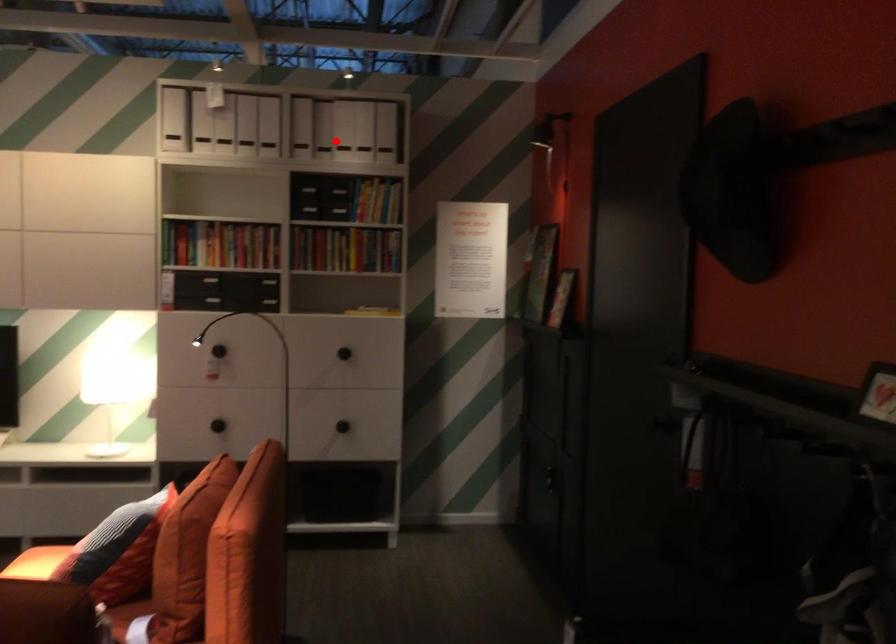
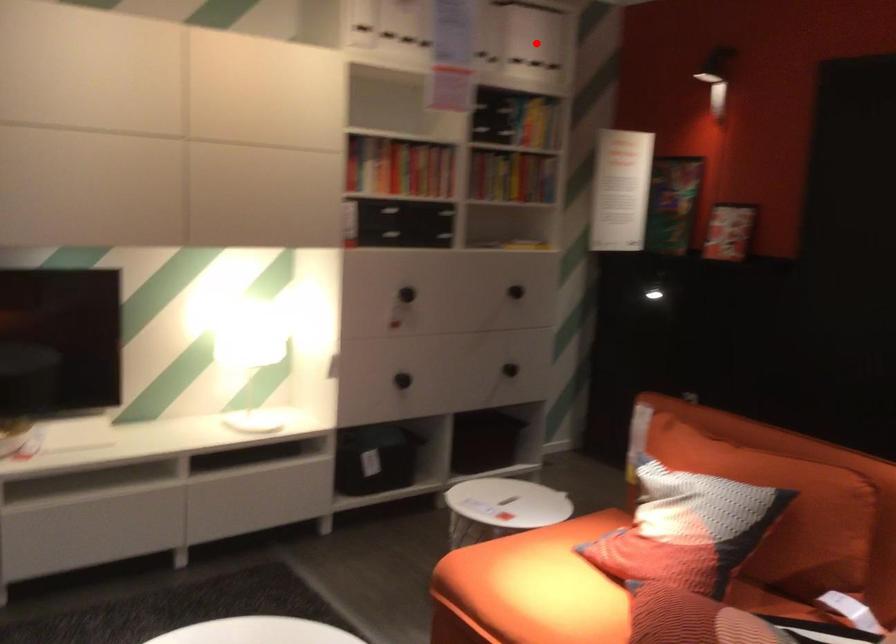
I am providing you with two images of the same scene from different viewpoints. A red point is marked on the first image and another point is marked on the second image. Are the points marked in image1 and image2 representing the same 3D position?

Yes